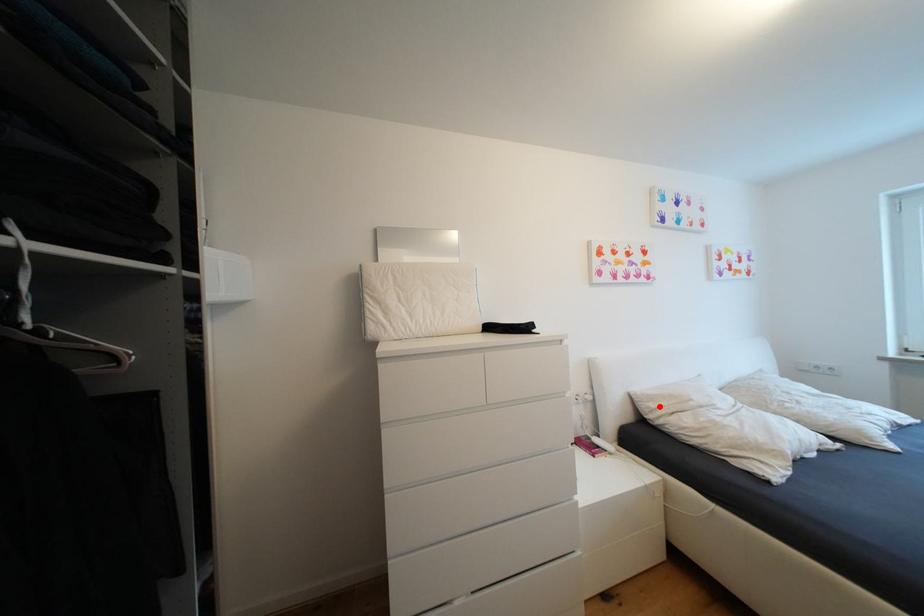
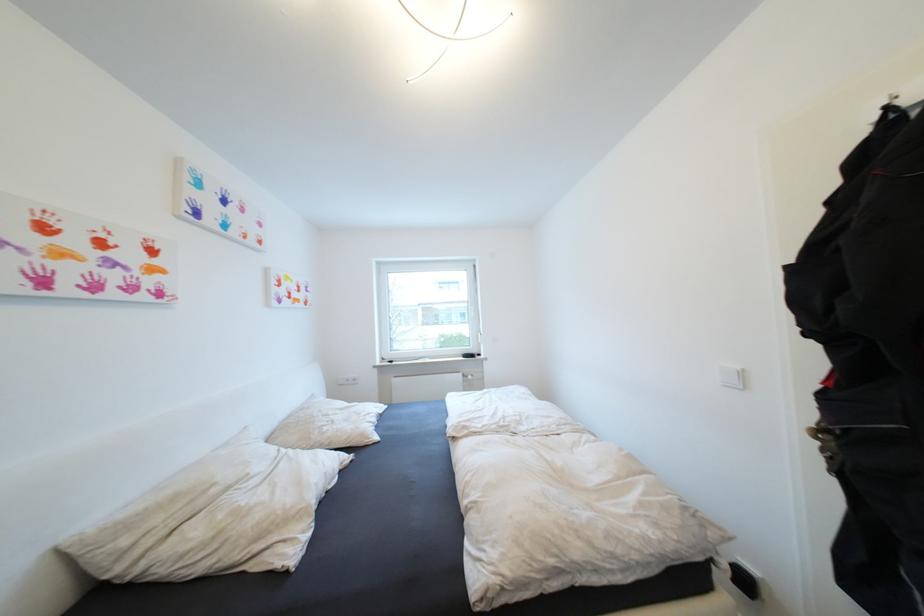
In the second image, find the point that corresponds to the highlighted location in the first image.

(131, 543)